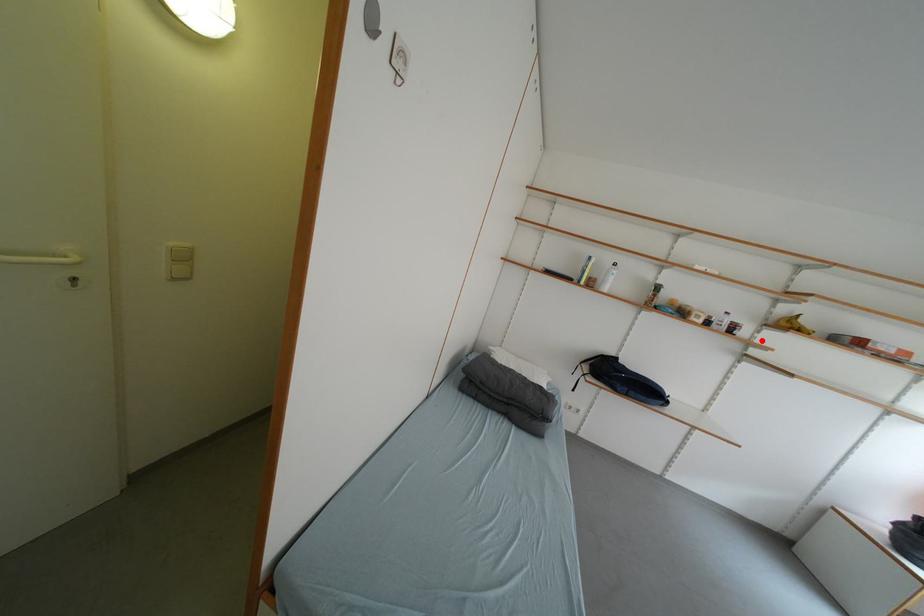
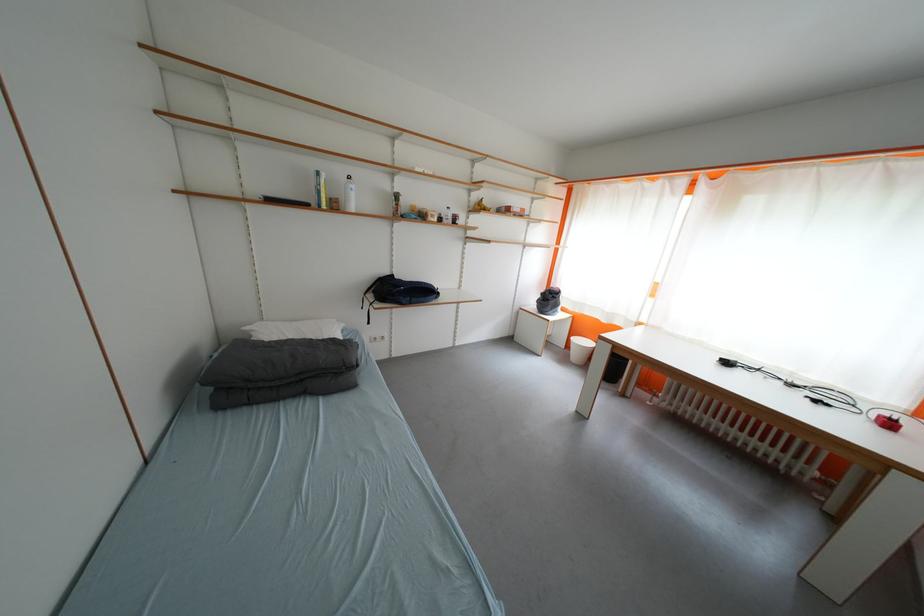
In the second image, find the point that corresponds to the highlighted location in the first image.

(476, 225)